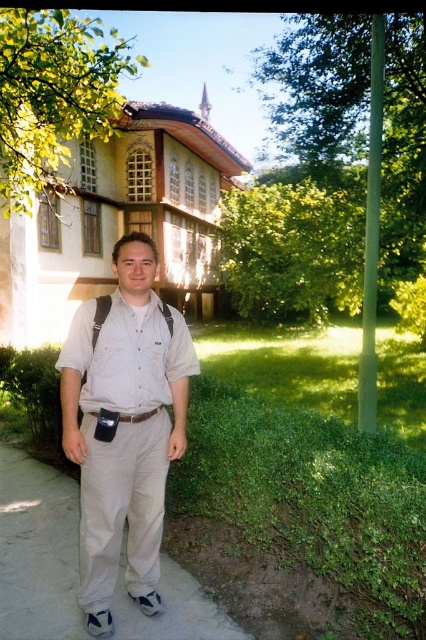
Question: Is light beige cotton shirt at center thinner than green leafy tree at upper center?

Choices:
 (A) no
 (B) yes

Answer: (B)

Question: Which is nearer to the green leafy tree at upper left?

Choices:
 (A) khaki pants at center
 (B) green leafy tree at upper center
 (C) gray concrete pavement at lower center
 (D) light beige cotton shirt at center

Answer: (A)

Question: Considering the relative positions of gray concrete pavement at lower center and green leafy tree at upper center in the image provided, where is gray concrete pavement at lower center located with respect to green leafy tree at upper center?

Choices:
 (A) below
 (B) above

Answer: (A)

Question: Observing the image, what is the correct spatial positioning of gray concrete pavement at lower center in reference to green leafy tree at upper center?

Choices:
 (A) right
 (B) left

Answer: (B)

Question: Estimate the real-world distances between objects in this image. Which object is closer to the gray fabric suspenders at center?

Choices:
 (A) gray concrete pavement at lower center
 (B) light beige cotton shirt at center
 (C) green leafy tree at upper left
 (D) black leather belt at center

Answer: (D)

Question: Considering the real-world distances, which object is farthest from the gray fabric suspenders at center?

Choices:
 (A) gray concrete pavement at lower center
 (B) black leather belt at center
 (C) khaki pants at center

Answer: (A)